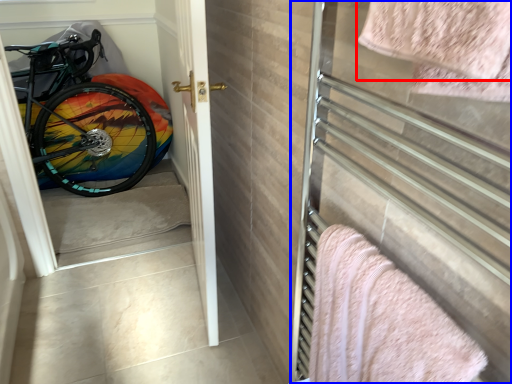
Question: Which point is further to the camera, towel (highlighted by a red box) or screen door (highlighted by a blue box)?

Choices:
 (A) towel
 (B) screen door

Answer: (B)